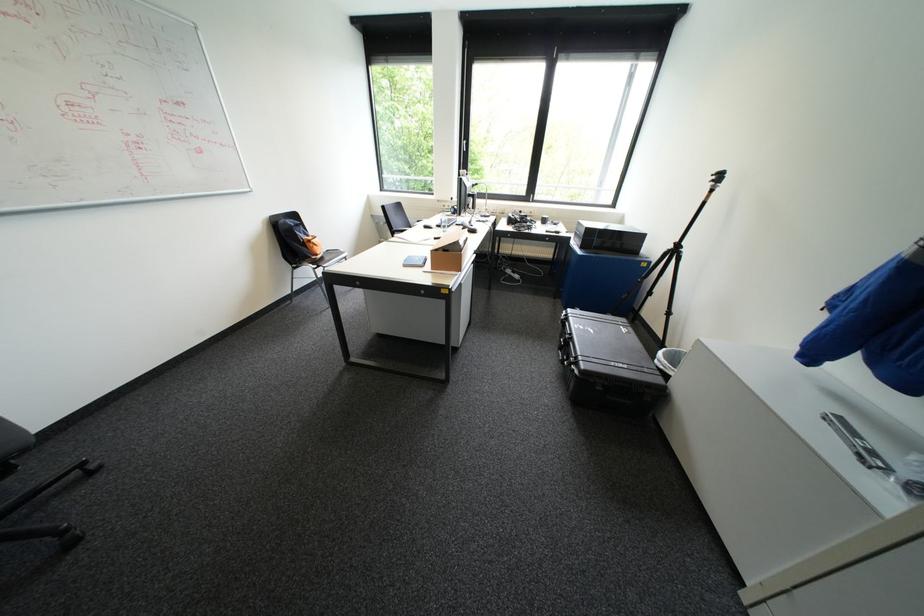
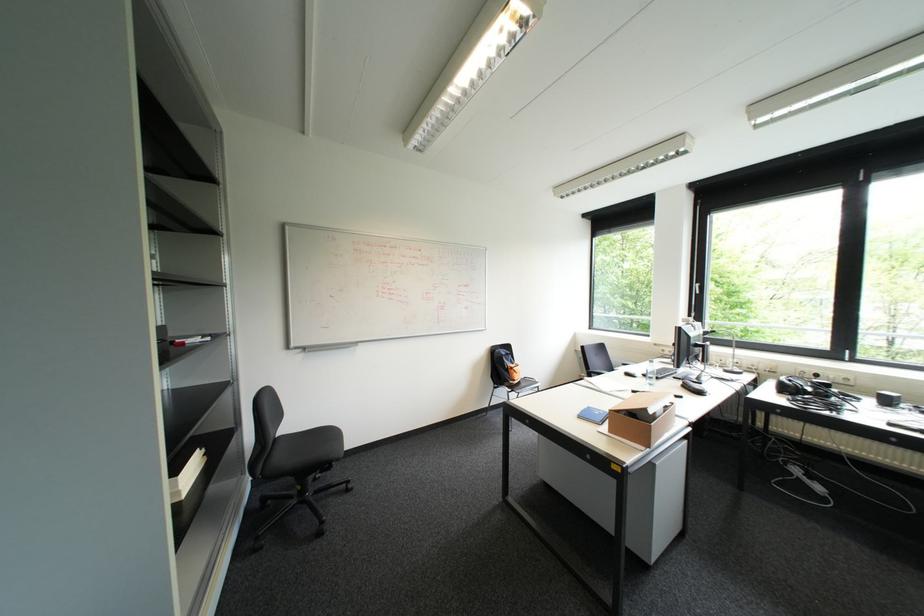
The first image is from the beginning of the video and the second image is from the end. How did the camera likely rotate when shooting the video?

The camera rotated toward left-up.